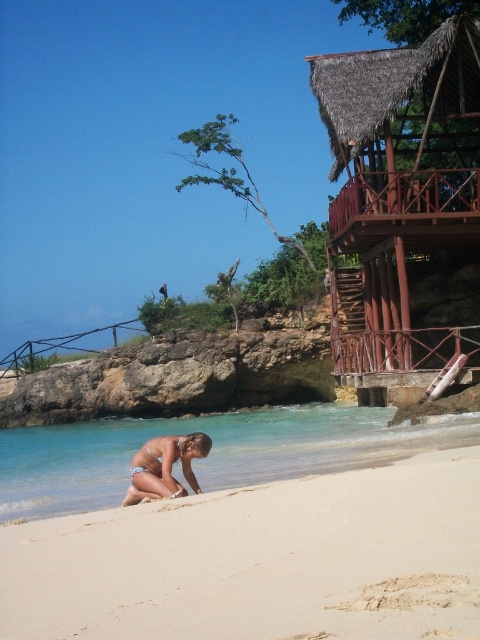
Question: Based on their relative distances, which object is nearer to the thatched wood hut at upper right?

Choices:
 (A) clear blue water at lower center
 (B) light blue bikini at lower center
 (C) white sandy beach at lower center

Answer: (A)

Question: Is white sandy beach at lower center to the right of light blue bikini at lower center from the viewer's perspective?

Choices:
 (A) no
 (B) yes

Answer: (B)

Question: Which object is positioned closest to the light blue bikini at lower center?

Choices:
 (A) thatched wood hut at upper right
 (B) clear blue water at lower center

Answer: (B)

Question: Among these objects, which one is farthest from the camera?

Choices:
 (A) white sandy beach at lower center
 (B) light blue bikini at lower center
 (C) clear blue water at lower center
 (D) thatched wood hut at upper right

Answer: (D)

Question: Does clear blue water at lower center have a larger size compared to light blue bikini at lower center?

Choices:
 (A) no
 (B) yes

Answer: (B)

Question: Does white sandy beach at lower center appear on the right side of light blue bikini at lower center?

Choices:
 (A) yes
 (B) no

Answer: (A)